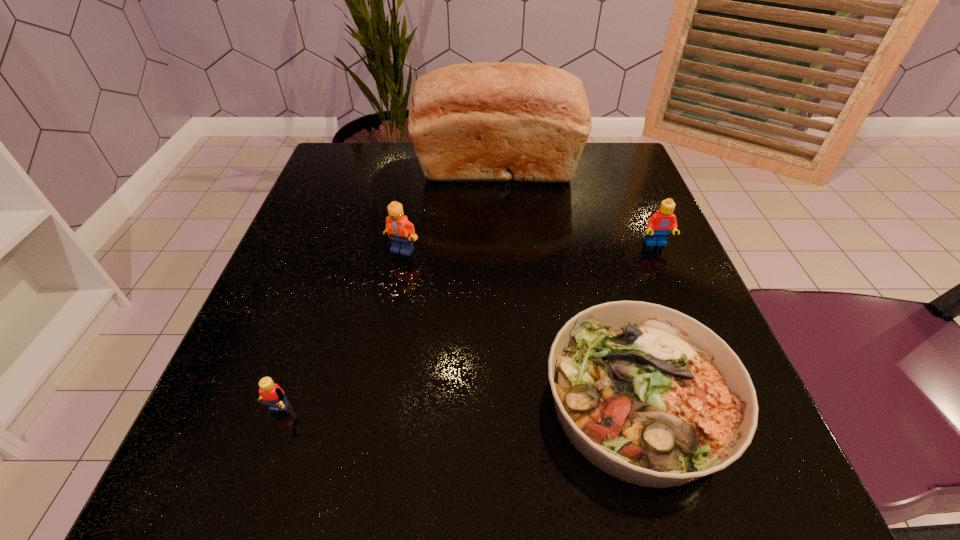
The image size is (960, 540). I want to click on object situated at the far right corner, so click(483, 121).

What are the coordinates of `object at the near right corner` in the screenshot? It's located at (649, 395).

This screenshot has height=540, width=960. In order to click on free space at the far edge of the desktop in this screenshot , I will do `click(535, 197)`.

In the image, there is a desktop. At what (x,y) coordinates should I click in order to perform the action: click on vacant space at the near edge. Please return your answer as a coordinate pair (x, y). Looking at the image, I should click on (500, 444).

Locate an element on the screen. The width and height of the screenshot is (960, 540). free space at the left edge is located at coordinates (351, 207).

The height and width of the screenshot is (540, 960). What are the coordinates of `vacant space at the right edge` in the screenshot? It's located at (595, 222).

Locate an element on the screen. This screenshot has width=960, height=540. vacant space at the far left corner of the desktop is located at coordinates (384, 143).

Locate an element on the screen. blank area at the far right corner is located at coordinates (615, 153).

Where is `blank space at the near right corner of the desktop`? This screenshot has height=540, width=960. blank space at the near right corner of the desktop is located at coordinates (763, 448).

Find the location of a particular element. This screenshot has width=960, height=540. free space that is in between the nearest Lego and the bread is located at coordinates (387, 295).